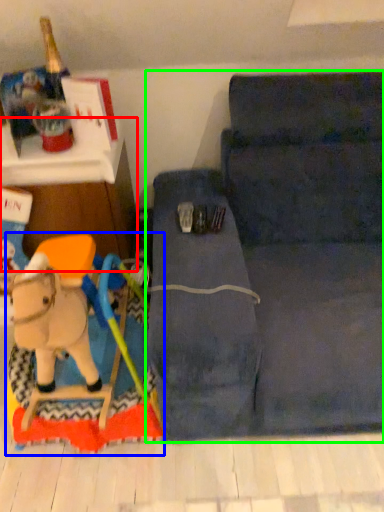
Question: Estimate the real-world distances between objects in this image. Which object is farther from furniture (highlighted by a red box), toy (highlighted by a blue box) or studio couch (highlighted by a green box)?

Choices:
 (A) toy
 (B) studio couch

Answer: (B)